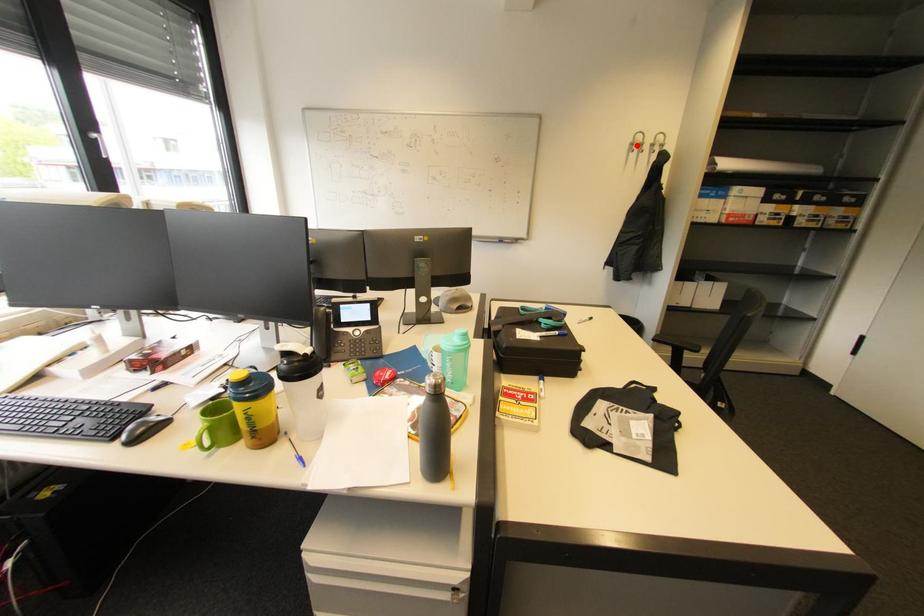
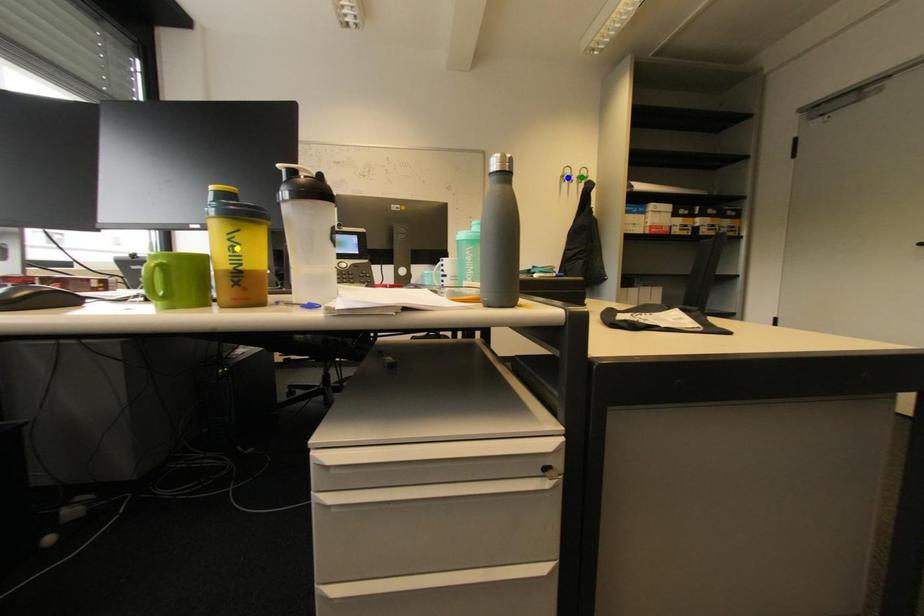
Question: I am providing you with two images of the same scene from different viewpoints. A red point is marked on the first image. You are given multiple points on the second image. Which point in image 2 represents the same 3d spot as the red point in image 1?

Choices:
 (A) green point
 (B) blue point
 (C) yellow point

Answer: (B)